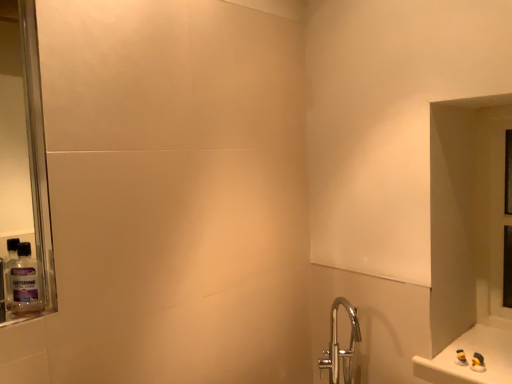
This screenshot has height=384, width=512. I want to click on vacant area on top of white glossy counter at lower right (from a real-world perspective), so click(x=475, y=350).